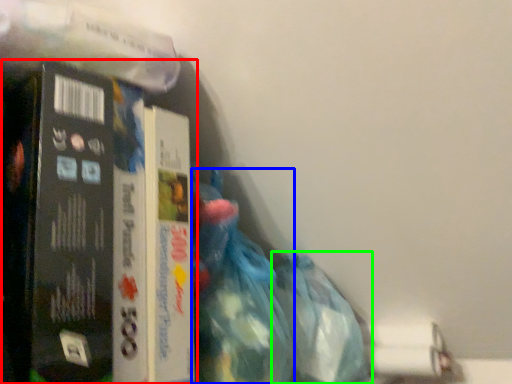
Question: Which object is positioned closest to book (highlighted by a red box)? Select from waste (highlighted by a blue box) and plastic bag (highlighted by a green box).

Choices:
 (A) waste
 (B) plastic bag

Answer: (A)